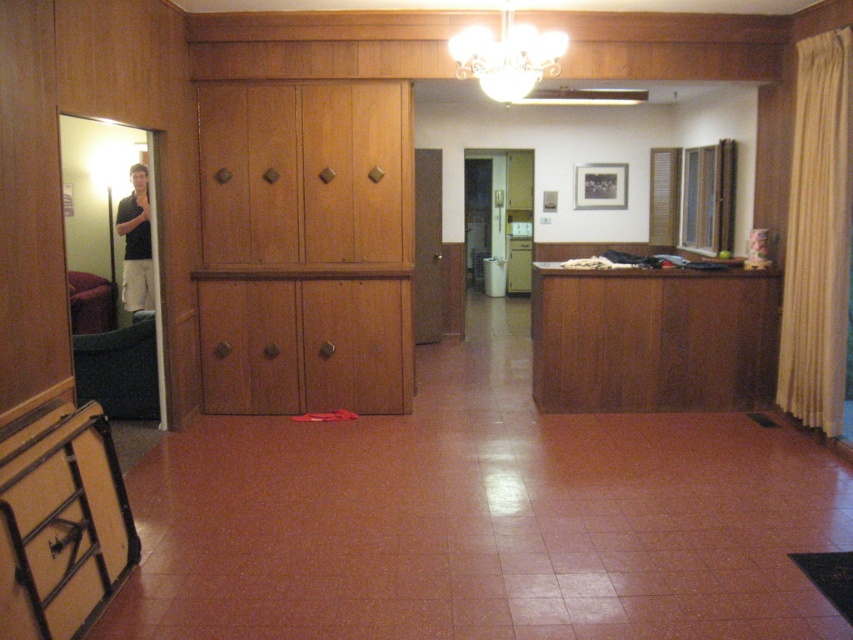
You are organizing items in the room and need to place a small plant pot between the matte black drawer at lower left and the beige fabric curtain at right. Based on their positions, which object should the plant pot be closer to?

The plant pot should be placed closer to the matte black drawer at lower left because it is in front of the beige fabric curtain at right, meaning it is closer to the viewer and thus the plant pot should be positioned nearer to it.

You are arranging furniture in a room with a wooden dresser at center and a beige fabric curtain at right. If you want to place a tall floor lamp between them, which object should the lamp be placed closer to?

The wooden dresser at center is not as tall as the beige fabric curtain at right, so the floor lamp should be placed closer to the beige fabric curtain at right to maintain visual balance.